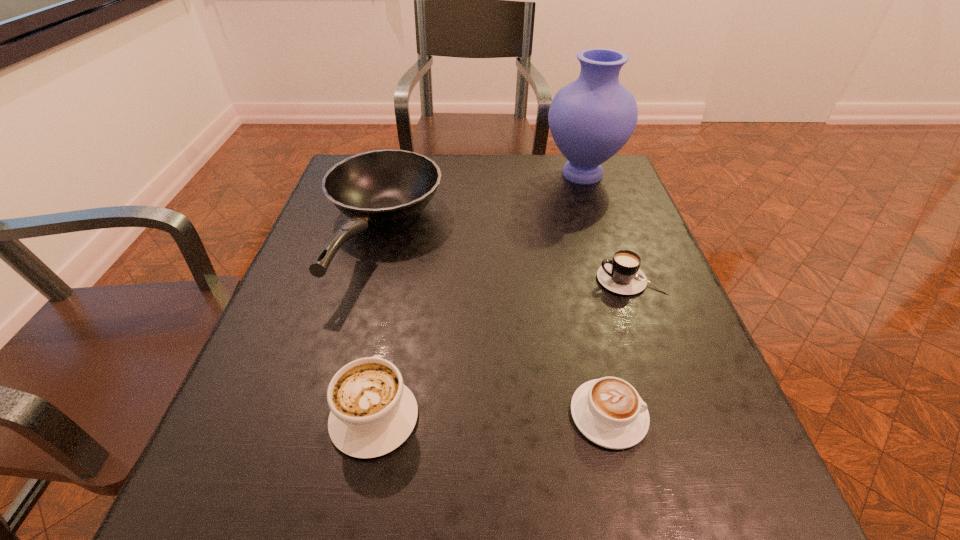
Locate an element on the screen. This screenshot has width=960, height=540. free space that satisfies the following two spatial constraints: 1. on the back side of the second tallest object; 2. on the left side of the tallest object is located at coordinates (397, 174).